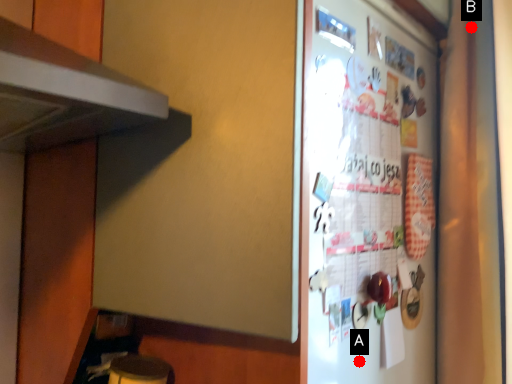
Question: Two points are circled on the image, labeled by A and B beside each circle. Which point is closer to the camera?

Choices:
 (A) A is closer
 (B) B is closer

Answer: (A)